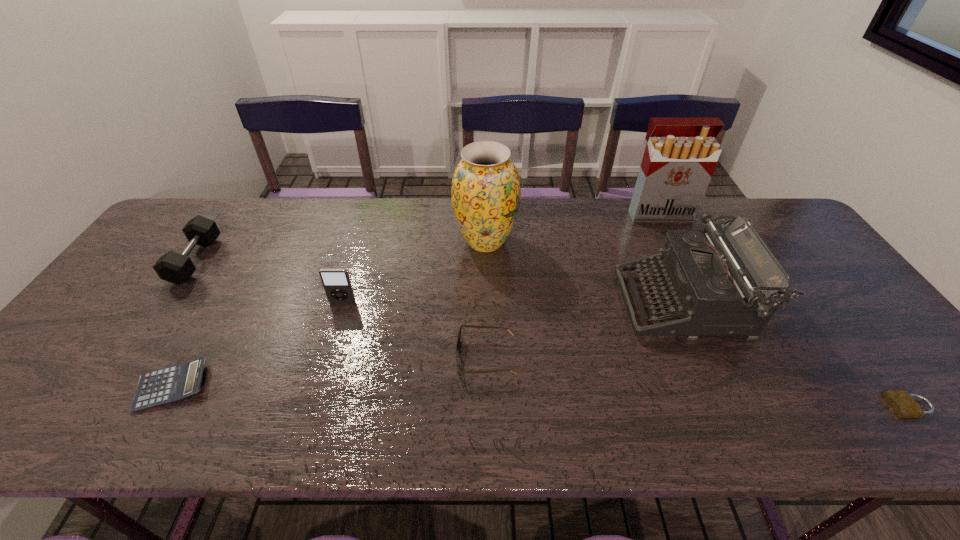
Where is `padlock that is at the near edge`? This screenshot has height=540, width=960. padlock that is at the near edge is located at coordinates (903, 404).

Find the location of `object that is at the left edge`. object that is at the left edge is located at coordinates (173, 267).

Find the location of a particular element. The image size is (960, 540). object that is at the right edge is located at coordinates (903, 404).

Image resolution: width=960 pixels, height=540 pixels. I want to click on object that is at the far left corner, so click(173, 267).

Image resolution: width=960 pixels, height=540 pixels. I want to click on object situated at the near right corner, so click(x=903, y=404).

In order to click on free space at the far edge in this screenshot , I will do `click(348, 226)`.

I want to click on free region at the near edge of the desktop, so click(665, 407).

In the image, there is a desktop. Where is `free space at the left edge`? The height and width of the screenshot is (540, 960). free space at the left edge is located at coordinates (31, 396).

Find the location of `vacant space at the right edge`. vacant space at the right edge is located at coordinates (796, 247).

Where is `free space at the near left corner of the desktop`? free space at the near left corner of the desktop is located at coordinates (85, 402).